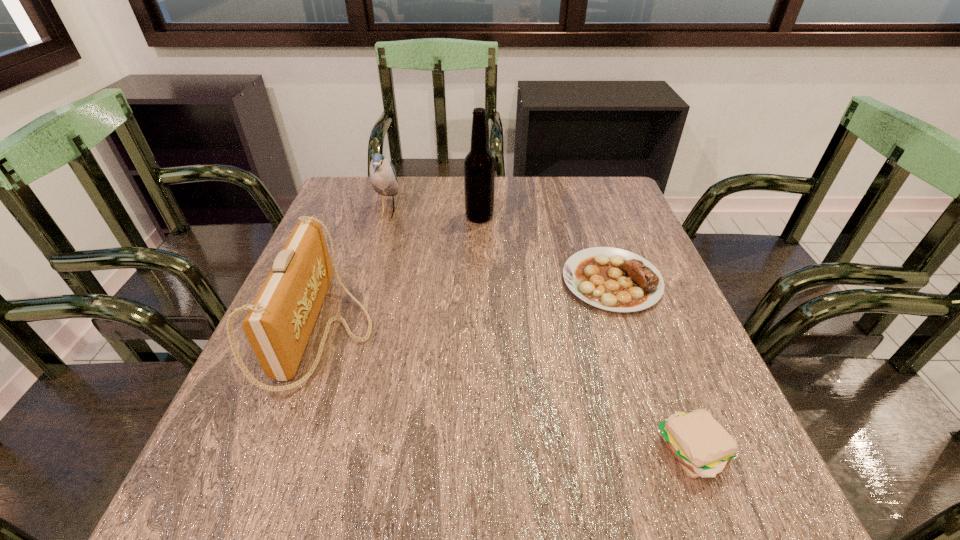
The width and height of the screenshot is (960, 540). I want to click on the third object from left to right, so point(479,165).

In order to click on beer bottle in this screenshot , I will do `click(479, 165)`.

You are a GUI agent. You are given a task and a screenshot of the screen. Output one action in this format:
    pyautogui.click(x=<x>, y=<y>)
    Task: Click on the bird
    The height and width of the screenshot is (540, 960).
    Given the screenshot: What is the action you would take?
    pyautogui.click(x=383, y=178)

Identify the location of handbag. This screenshot has width=960, height=540. (278, 325).

Where is `patty`? This screenshot has width=960, height=540. patty is located at coordinates (701, 445).

What are the coordinates of `the second shortest object` in the screenshot? It's located at (701, 445).

In order to click on steak in this screenshot , I will do `click(613, 279)`.

You are a GUI agent. You are given a task and a screenshot of the screen. Output one action in this format:
    pyautogui.click(x=<x>, y=<y>)
    Task: Click on the free location located on the back of the third object from right to left
    The image size is (960, 540).
    Given the screenshot: What is the action you would take?
    pyautogui.click(x=479, y=188)

Identify the location of blank area located 0.380m at the tip of the bird's beak. click(536, 212).

At what (x,y) coordinates should I click in order to perform the action: click on vacant region located 0.320m on the decorative side of the handbag. Please return your answer as a coordinate pair (x, y). The height and width of the screenshot is (540, 960). Looking at the image, I should click on (530, 332).